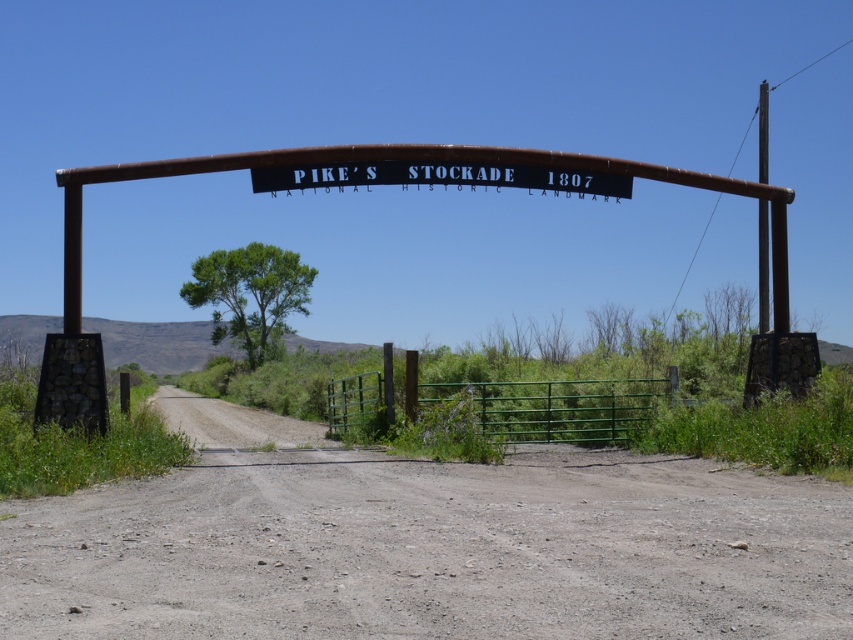
Question: Can you confirm if dirt/gravel road at center is smaller than black metal sign at center?

Choices:
 (A) yes
 (B) no

Answer: (B)

Question: Among these points, which one is nearest to the camera?

Choices:
 (A) (605, 608)
 (B) (592, 177)

Answer: (A)

Question: Can you confirm if dirt/gravel road at center is positioned to the left of black metal sign at center?

Choices:
 (A) yes
 (B) no

Answer: (B)

Question: Can you confirm if dirt/gravel road at center is positioned below black metal sign at center?

Choices:
 (A) no
 (B) yes

Answer: (B)